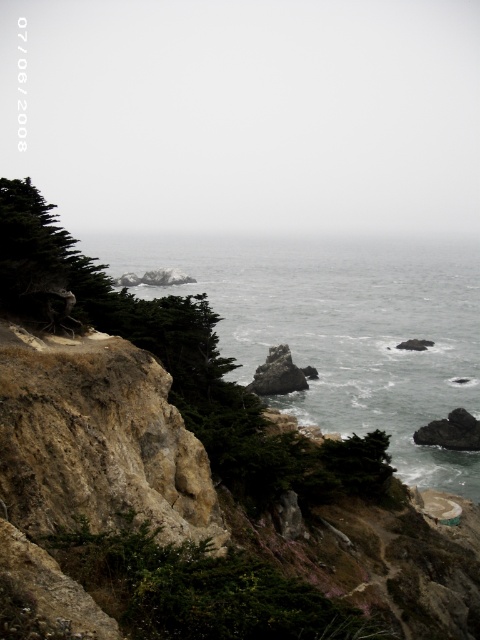
Based on the provided scene description, what does the point at coordinates (339, 326) represent?

The point at coordinates (339, 326) represents gray rocky water at center.